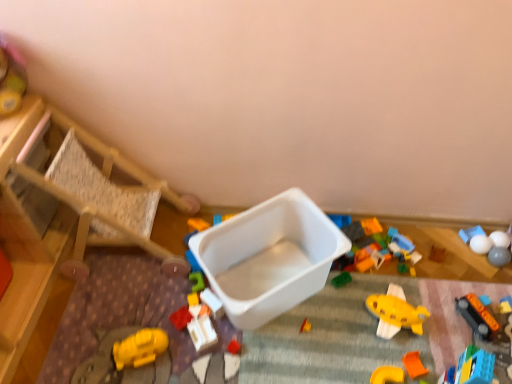
Image resolution: width=512 pixels, height=384 pixels. I want to click on vacant area that lies between orange matte plastic toy at lower right, the 10th toy viewed from the right, and yellow matte airplane at center, placed as the eighth toy when sorted from right to left, so click(383, 359).